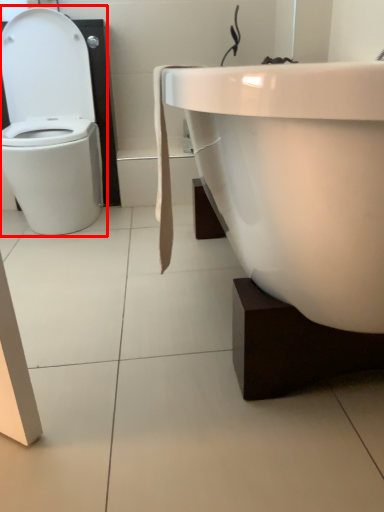
Question: Considering the relative positions of toilet (annotated by the red box) and sink in the image provided, where is toilet (annotated by the red box) located with respect to the staircase?

Choices:
 (A) left
 (B) right

Answer: (A)